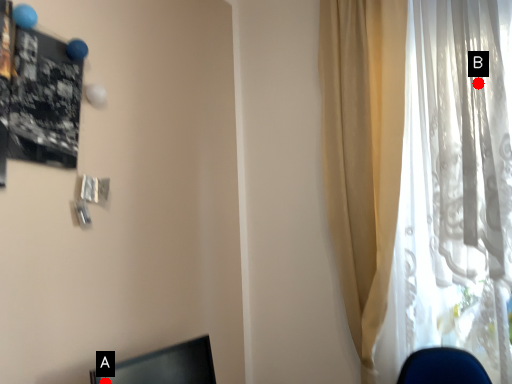
Question: Two points are circled on the image, labeled by A and B beside each circle. Which point is closer to the camera taking this photo?

Choices:
 (A) A is closer
 (B) B is closer

Answer: (A)